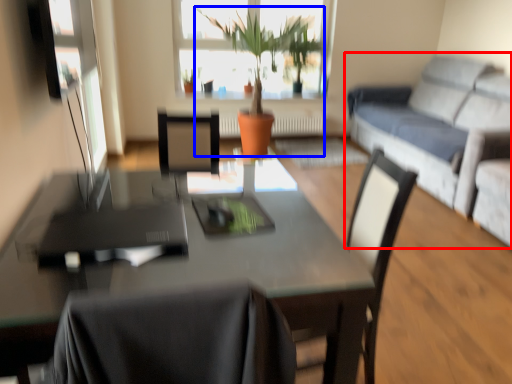
Question: Among these objects, which one is farthest to the camera, studio couch (highlighted by a red box) or houseplant (highlighted by a blue box)?

Choices:
 (A) studio couch
 (B) houseplant

Answer: (B)